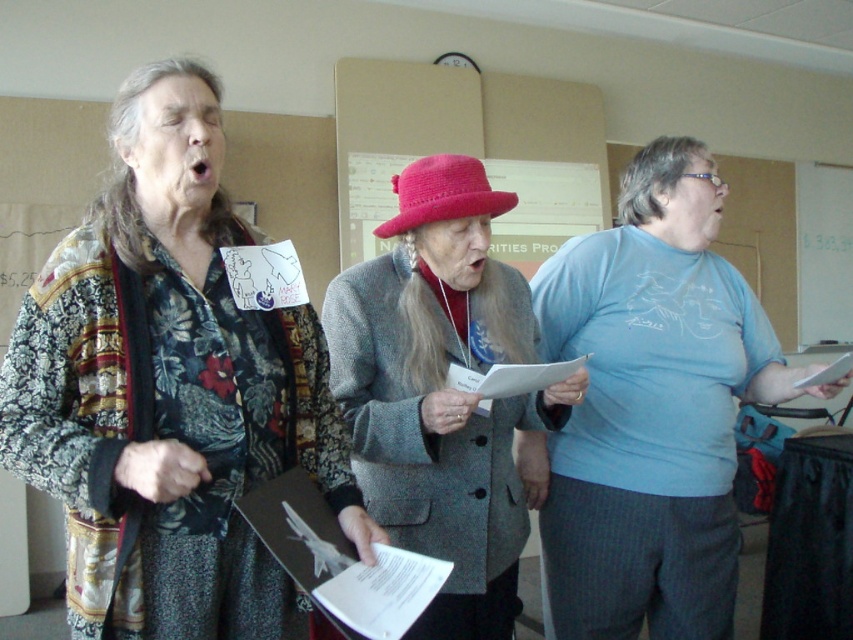
You are standing in the room and want to greet the person wearing the floral fabric shirt at left and the pink woolen hat at center. Which one is closer to your right side?

The pink woolen hat at center is closer to your right side because the floral fabric shirt at left is to the left of the pink woolen hat at center.

You are organizing a costume party and need to ensure all participants have enough space. If the floral fabric shirt at left and the pink woolen hat at center are placed side by side on a shelf, which one requires more horizontal space?

The floral fabric shirt at left requires more horizontal space because its width is larger than the pink woolen hat at center.